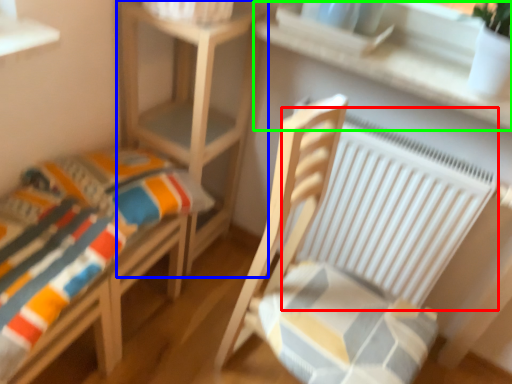
Question: Estimate the real-world distances between objects in this image. Which object is closer to radiator (highlighted by a red box), table (highlighted by a blue box) or window sill (highlighted by a green box)?

Choices:
 (A) table
 (B) window sill

Answer: (B)